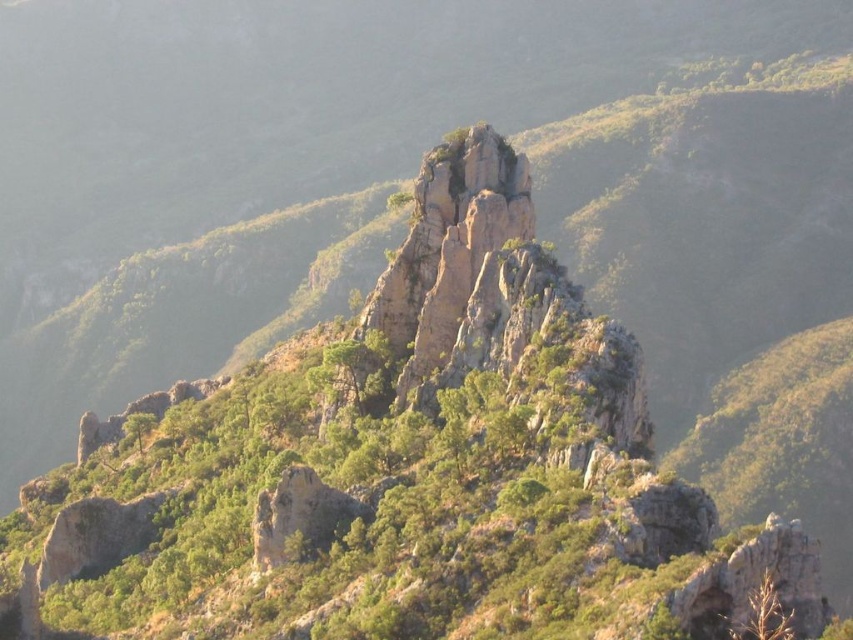
You are a hiker planning to climb the rugged stone rock at center and the rough textured rock at center. Based on the scene, which rock should you climb first if you want to reach the one that is farther away from your current position?

You should climb the rough textured rock at center first because it is behind the rugged stone rock at center, meaning it is farther away from your current position.

You are a hiker standing at the base of the mountain. You see the rugged stone rock at center and the rough textured rock at center. Which rock is closer to you?

Both the rugged stone rock at center and the rough textured rock at center are at the same distance from you since they are described as being at the center of the scene.